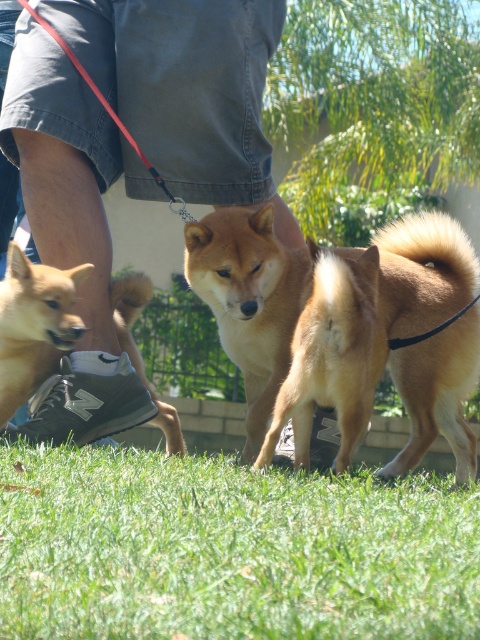
Who is positioned more to the right, gray denim shorts at lower left or golden fur dog at lower left?

From the viewer's perspective, gray denim shorts at lower left appears more on the right side.

Does gray denim shorts at lower left appear under golden fur dog at lower left?

Actually, gray denim shorts at lower left is above golden fur dog at lower left.

The width and height of the screenshot is (480, 640). Describe the element at coordinates (187, 88) in the screenshot. I see `gray denim shorts at lower left` at that location.

Where is `gray denim shorts at lower left`? The width and height of the screenshot is (480, 640). gray denim shorts at lower left is located at coordinates (187, 88).

Can you confirm if golden fur dog at center is shorter than golden fur dog at lower left?

No, golden fur dog at center is not shorter than golden fur dog at lower left.

Between golden fur dog at center and golden fur dog at lower left, which one is positioned higher?

golden fur dog at lower left is higher up.

Does point (235, 348) lie in front of point (57, 269)?

No, (235, 348) is behind (57, 269).

Image resolution: width=480 pixels, height=640 pixels. I want to click on golden fur dog at center, so click(x=249, y=300).

Which is above, green grass at lower center or gray denim shorts at lower left?

gray denim shorts at lower left is higher up.

Can you confirm if green grass at lower center is thinner than gray denim shorts at lower left?

In fact, green grass at lower center might be wider than gray denim shorts at lower left.

The image size is (480, 640). What do you see at coordinates (228, 548) in the screenshot?
I see `green grass at lower center` at bounding box center [228, 548].

Where is `green grass at lower center`? This screenshot has width=480, height=640. green grass at lower center is located at coordinates (228, 548).